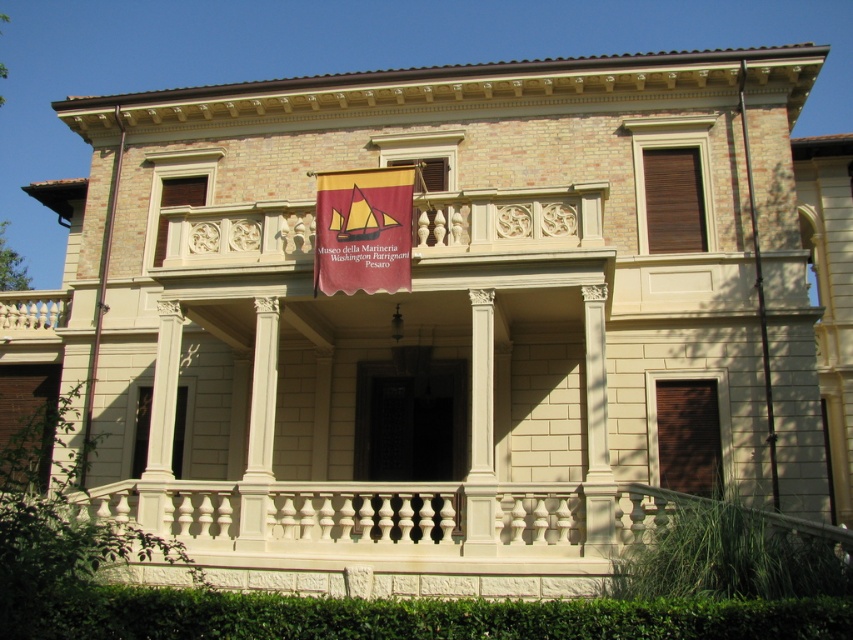
Question: In this image, where is white stone balcony at center located relative to maroon fabric banner at center?

Choices:
 (A) right
 (B) left

Answer: (B)

Question: Which point is farther to the camera?

Choices:
 (A) (248, 244)
 (B) (387, 172)

Answer: (A)

Question: Which point is closer to the camera?

Choices:
 (A) (436, 248)
 (B) (383, 250)

Answer: (B)

Question: Does white stone balcony at center appear on the left side of maroon fabric banner at center?

Choices:
 (A) yes
 (B) no

Answer: (A)

Question: Which point is closer to the camera?

Choices:
 (A) (566, 211)
 (B) (357, 177)

Answer: (A)

Question: Is the position of white stone balcony at center more distant than that of maroon fabric banner at center?

Choices:
 (A) yes
 (B) no

Answer: (A)